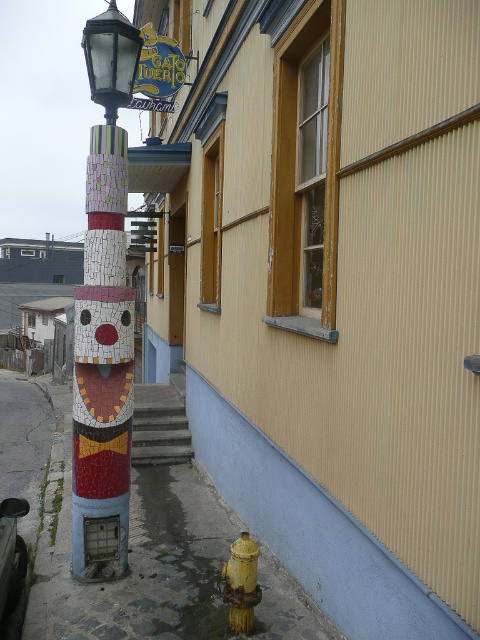
You are standing at the point marked as point (154,563). Looking towards the colorful column on the left, which direction should you walk to reach the beige building on the right?

Since the point is on the smooth concrete sidewalk at lower left, you should walk towards the beige building on the right by moving to the right direction from your current position.

You are a city planner assessing the street layout. You need to determine if the matte glass street light at upper left can be replaced with a wider model without affecting the yellow matte hydrant at lower right. Based on their current widths, is this feasible?

The matte glass street light at upper left is wider than the yellow matte hydrant at lower right. Therefore, replacing it with a wider model may require checking if there is enough space, as its current width already exceeds the hydrant.

You are a delivery person trying to navigate a narrow alley between the matte glass street light at upper left and the yellow matte hydrant at lower right. Can you pass through the space between them?

The matte glass street light at upper left is located above the yellow matte hydrant at lower right, so there is vertical space between them but no horizontal clearance. You cannot pass through the space between them horizontally.